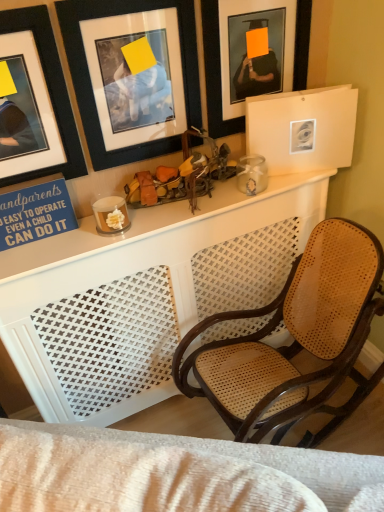
This screenshot has height=512, width=384. What do you see at coordinates (34, 102) in the screenshot? I see `black matte picture frame at upper left, acting as the 1th picture frame starting from the left` at bounding box center [34, 102].

Identify the location of matte black picture frame at upper center, the first picture frame in the right-to-left sequence. (215, 73).

Which object is further away from the camera, black matte picture frame at upper left, the 3th picture frame in the right-to-left sequence, or black matte picture frame at upper left, which appears as the second picture frame when viewed from the left?

black matte picture frame at upper left, which appears as the second picture frame when viewed from the left, is further from the camera.

How distant is black matte picture frame at upper left, the 3th picture frame in the right-to-left sequence, from black matte picture frame at upper left, which is the 2th picture frame in right-to-left order?

black matte picture frame at upper left, the 3th picture frame in the right-to-left sequence, and black matte picture frame at upper left, which is the 2th picture frame in right-to-left order, are 5.44 inches apart from each other.

Considering the sizes of black matte picture frame at upper left, the 3th picture frame in the right-to-left sequence, and black matte picture frame at upper left, which appears as the second picture frame when viewed from the left, in the image, is black matte picture frame at upper left, the 3th picture frame in the right-to-left sequence, taller or shorter than black matte picture frame at upper left, which appears as the second picture frame when viewed from the left,?

In the image, black matte picture frame at upper left, the 3th picture frame in the right-to-left sequence, appears to be shorter than black matte picture frame at upper left, which appears as the second picture frame when viewed from the left.

From a real-world perspective, which is physically above, black matte picture frame at upper left, acting as the 1th picture frame starting from the left, or black matte picture frame at upper left, which is the 2th picture frame in right-to-left order?

From a 3D spatial view, black matte picture frame at upper left, which is the 2th picture frame in right-to-left order, is above.

Which is correct: matte black picture frame at upper center, the first picture frame in the right-to-left sequence, is inside black matte picture frame at upper left, the 3th picture frame in the right-to-left sequence, or outside of it?

matte black picture frame at upper center, the first picture frame in the right-to-left sequence, is spatially situated outside black matte picture frame at upper left, the 3th picture frame in the right-to-left sequence.

Which object is positioned more to the right, matte black picture frame at upper center, which appears as the third picture frame when viewed from the left, or black matte picture frame at upper left, acting as the 1th picture frame starting from the left?

From the viewer's perspective, matte black picture frame at upper center, which appears as the third picture frame when viewed from the left, appears more on the right side.

Consider the image. Is matte black picture frame at upper center, which appears as the third picture frame when viewed from the left, facing away from black matte picture frame at upper left, the 3th picture frame in the right-to-left sequence?

That's not correct — matte black picture frame at upper center, which appears as the third picture frame when viewed from the left, is not looking away from black matte picture frame at upper left, the 3th picture frame in the right-to-left sequence.

Which is closer to the camera, (189, 26) or (213, 71)?

Point (189, 26)

Is black matte picture frame at upper left, which is the 2th picture frame in right-to-left order, oriented towards matte black picture frame at upper center, which appears as the third picture frame when viewed from the left?

No, black matte picture frame at upper left, which is the 2th picture frame in right-to-left order, is not oriented towards matte black picture frame at upper center, which appears as the third picture frame when viewed from the left.

Is black matte picture frame at upper left, which is the 2th picture frame in right-to-left order, not inside matte black picture frame at upper center, the first picture frame in the right-to-left sequence?

Yes, black matte picture frame at upper left, which is the 2th picture frame in right-to-left order, is not within matte black picture frame at upper center, the first picture frame in the right-to-left sequence.

How different are the orientations of black matte picture frame at upper left, which is the 2th picture frame in right-to-left order, and matte black picture frame at upper center, which appears as the third picture frame when viewed from the left, in degrees?

0.00433 degrees separate the facing orientations of black matte picture frame at upper left, which is the 2th picture frame in right-to-left order, and matte black picture frame at upper center, which appears as the third picture frame when viewed from the left.

The width and height of the screenshot is (384, 512). Find the location of `the 2nd picture frame to the right of the black matte picture frame at upper left, the 3th picture frame in the right-to-left sequence, counting from the anchor's position`. the 2nd picture frame to the right of the black matte picture frame at upper left, the 3th picture frame in the right-to-left sequence, counting from the anchor's position is located at coordinates [x=215, y=73].

Is black matte picture frame at upper left, acting as the 1th picture frame starting from the left, looking in the opposite direction of matte black picture frame at upper center, the first picture frame in the right-to-left sequence?

That's not correct — black matte picture frame at upper left, acting as the 1th picture frame starting from the left, is not looking away from matte black picture frame at upper center, the first picture frame in the right-to-left sequence.

Which object is positioned more to the right, black matte picture frame at upper left, acting as the 1th picture frame starting from the left, or matte black picture frame at upper center, which appears as the third picture frame when viewed from the left?

From the viewer's perspective, matte black picture frame at upper center, which appears as the third picture frame when viewed from the left, appears more on the right side.

Can you confirm if black matte picture frame at upper left, acting as the 1th picture frame starting from the left, is taller than matte black picture frame at upper center, which appears as the third picture frame when viewed from the left?

In fact, black matte picture frame at upper left, acting as the 1th picture frame starting from the left, may be shorter than matte black picture frame at upper center, which appears as the third picture frame when viewed from the left.

Can you confirm if black matte picture frame at upper left, which is the 2th picture frame in right-to-left order, is smaller than black matte picture frame at upper left, acting as the 1th picture frame starting from the left?

Actually, black matte picture frame at upper left, which is the 2th picture frame in right-to-left order, might be larger than black matte picture frame at upper left, acting as the 1th picture frame starting from the left.

Could you measure the distance between black matte picture frame at upper left, which is the 2th picture frame in right-to-left order, and black matte picture frame at upper left, the 3th picture frame in the right-to-left sequence?

black matte picture frame at upper left, which is the 2th picture frame in right-to-left order, is 5.44 inches away from black matte picture frame at upper left, the 3th picture frame in the right-to-left sequence.

Are black matte picture frame at upper left, which appears as the second picture frame when viewed from the left, and black matte picture frame at upper left, acting as the 1th picture frame starting from the left, far apart?

They are positioned close to each other.

Between black matte picture frame at upper left, which appears as the second picture frame when viewed from the left, and black matte picture frame at upper left, acting as the 1th picture frame starting from the left, which one has less height?

black matte picture frame at upper left, acting as the 1th picture frame starting from the left, is shorter.

Is matte black picture frame at upper center, the first picture frame in the right-to-left sequence, looking in the opposite direction of black matte picture frame at upper left, which appears as the second picture frame when viewed from the left?

matte black picture frame at upper center, the first picture frame in the right-to-left sequence, is not turned away from black matte picture frame at upper left, which appears as the second picture frame when viewed from the left.

From a real-world perspective, is matte black picture frame at upper center, which appears as the third picture frame when viewed from the left, physically below black matte picture frame at upper left, which is the 2th picture frame in right-to-left order?

No.

Is matte black picture frame at upper center, the first picture frame in the right-to-left sequence, far from black matte picture frame at upper left, which is the 2th picture frame in right-to-left order?

No, matte black picture frame at upper center, the first picture frame in the right-to-left sequence, is in close proximity to black matte picture frame at upper left, which is the 2th picture frame in right-to-left order.

From the image's perspective, is matte black picture frame at upper center, the first picture frame in the right-to-left sequence, located beneath black matte picture frame at upper left, which appears as the second picture frame when viewed from the left?

Incorrect, from the image's perspective, matte black picture frame at upper center, the first picture frame in the right-to-left sequence, is higher than black matte picture frame at upper left, which appears as the second picture frame when viewed from the left.

Where is `the 1st picture frame directly above the black matte picture frame at upper left, acting as the 1th picture frame starting from the left (from a real-world perspective)`? Image resolution: width=384 pixels, height=512 pixels. the 1st picture frame directly above the black matte picture frame at upper left, acting as the 1th picture frame starting from the left (from a real-world perspective) is located at coordinates (x=90, y=82).

The height and width of the screenshot is (512, 384). Find the location of `the 2nd picture frame to the left of the matte black picture frame at upper center, which appears as the third picture frame when viewed from the left, counting from the anchor's position`. the 2nd picture frame to the left of the matte black picture frame at upper center, which appears as the third picture frame when viewed from the left, counting from the anchor's position is located at coordinates (34, 102).

Which object lies nearer to the anchor point matte black picture frame at upper center, the first picture frame in the right-to-left sequence, black matte picture frame at upper left, which appears as the second picture frame when viewed from the left, or black matte picture frame at upper left, acting as the 1th picture frame starting from the left?

The object closer to matte black picture frame at upper center, the first picture frame in the right-to-left sequence, is black matte picture frame at upper left, which appears as the second picture frame when viewed from the left.

Looking at the image, which one is located further to black matte picture frame at upper left, which appears as the second picture frame when viewed from the left, black matte picture frame at upper left, the 3th picture frame in the right-to-left sequence, or matte black picture frame at upper center, the first picture frame in the right-to-left sequence?

Based on the image, matte black picture frame at upper center, the first picture frame in the right-to-left sequence, appears to be further to black matte picture frame at upper left, which appears as the second picture frame when viewed from the left.

Based on the photo, based on their spatial positions, is matte black picture frame at upper center, the first picture frame in the right-to-left sequence, or black matte picture frame at upper left, acting as the 1th picture frame starting from the left, further from black matte picture frame at upper left, which is the 2th picture frame in right-to-left order?

matte black picture frame at upper center, the first picture frame in the right-to-left sequence, is positioned further to the anchor black matte picture frame at upper left, which is the 2th picture frame in right-to-left order.

When comparing their distances from black matte picture frame at upper left, acting as the 1th picture frame starting from the left, does black matte picture frame at upper left, which appears as the second picture frame when viewed from the left, or matte black picture frame at upper center, the first picture frame in the right-to-left sequence, seem closer?

Based on the image, black matte picture frame at upper left, which appears as the second picture frame when viewed from the left, appears to be nearer to black matte picture frame at upper left, acting as the 1th picture frame starting from the left.

Looking at the image, which one is located further to black matte picture frame at upper left, acting as the 1th picture frame starting from the left, matte black picture frame at upper center, which appears as the third picture frame when viewed from the left, or black matte picture frame at upper left, which appears as the second picture frame when viewed from the left?

matte black picture frame at upper center, which appears as the third picture frame when viewed from the left, lies further to black matte picture frame at upper left, acting as the 1th picture frame starting from the left, than the other object.

From the image, which object appears to be farther from matte black picture frame at upper center, which appears as the third picture frame when viewed from the left, black matte picture frame at upper left, acting as the 1th picture frame starting from the left, or black matte picture frame at upper left, which appears as the second picture frame when viewed from the left?

Among the two, black matte picture frame at upper left, acting as the 1th picture frame starting from the left, is located further to matte black picture frame at upper center, which appears as the third picture frame when viewed from the left.

Find the location of a particular element. The width and height of the screenshot is (384, 512). picture frame between black matte picture frame at upper left, the 3th picture frame in the right-to-left sequence, and matte black picture frame at upper center, which appears as the third picture frame when viewed from the left, from left to right is located at coordinates (90, 82).